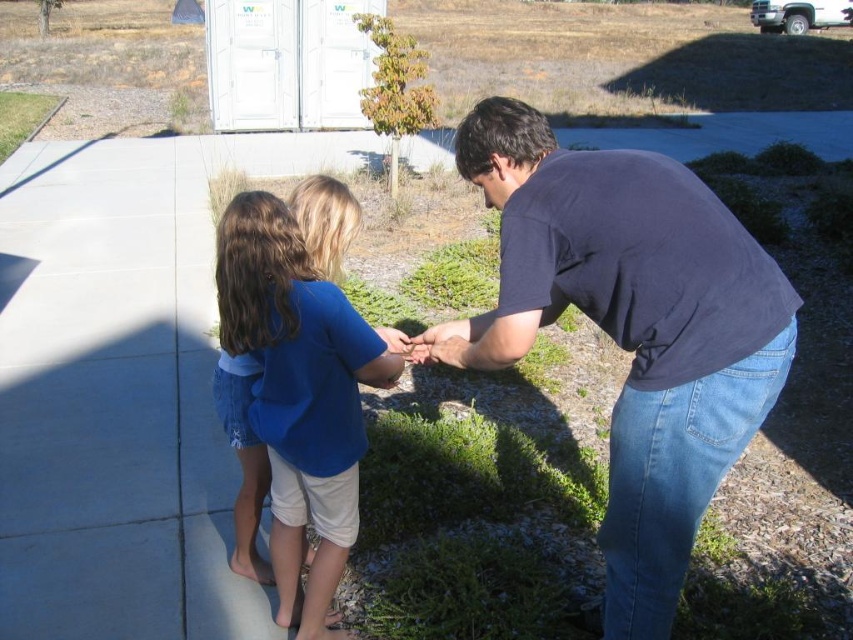
Question: Does dark blue shirt at center lie in front of blue cotton shirt at center?

Choices:
 (A) no
 (B) yes

Answer: (B)

Question: Can you confirm if dark blue shirt at center is positioned above blue cotton shirt at center?

Choices:
 (A) yes
 (B) no

Answer: (A)

Question: Which point is closer to the camera taking this photo?

Choices:
 (A) (306, 337)
 (B) (537, 122)

Answer: (A)

Question: Among these points, which one is farthest from the camera?

Choices:
 (A) (331, 500)
 (B) (502, 182)

Answer: (A)

Question: Observing the image, what is the correct spatial positioning of dark blue shirt at center in reference to blue cotton shirt at center?

Choices:
 (A) above
 (B) below

Answer: (A)